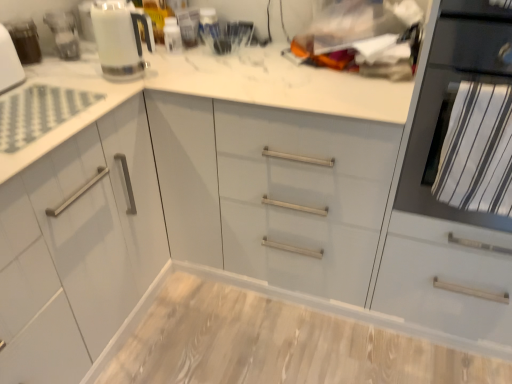
Where is `vacant area on the back side of white glossy kettle at upper left`? vacant area on the back side of white glossy kettle at upper left is located at coordinates (150, 57).